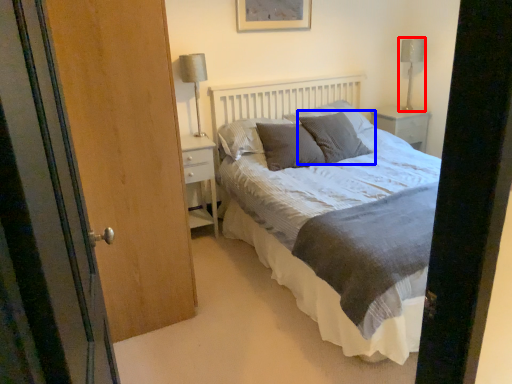
Question: Which of the following is the closest to the observer, table lamp (highlighted by a red box) or pillow (highlighted by a blue box)?

Choices:
 (A) table lamp
 (B) pillow

Answer: (B)